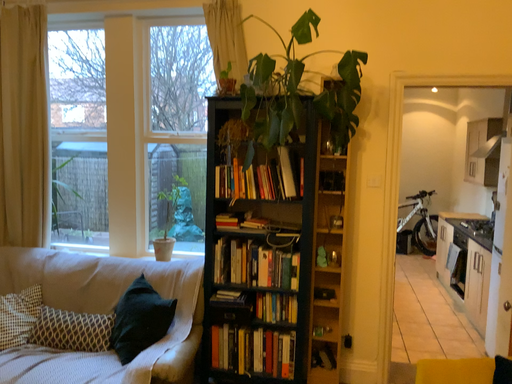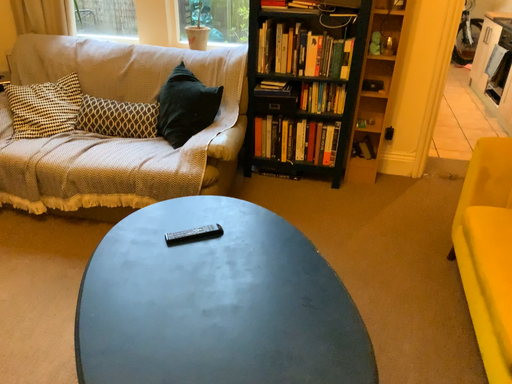
Question: Which way did the camera rotate in the video?

Choices:
 (A) rotated downward
 (B) rotated upward

Answer: (A)